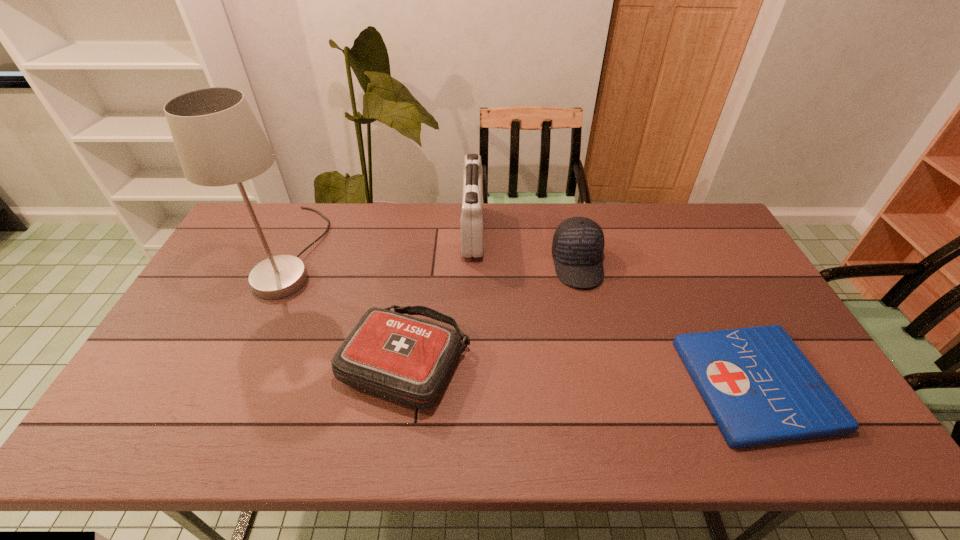
Where is `table lamp`? table lamp is located at coordinates (219, 142).

This screenshot has width=960, height=540. What are the coordinates of `the leftmost object` in the screenshot? It's located at (219, 142).

Locate an element on the screen. the farthest first-aid kit is located at coordinates (472, 218).

This screenshot has height=540, width=960. I want to click on the fourth shortest object, so click(472, 218).

The image size is (960, 540). Find the location of `the fourth object from left to right`. the fourth object from left to right is located at coordinates (578, 243).

In order to click on the third tallest object in this screenshot , I will do pos(578,243).

Locate an element on the screen. This screenshot has width=960, height=540. the fourth tallest object is located at coordinates (408, 360).

Find the location of a particular element. the shortest first-aid kit is located at coordinates (759, 387).

At what (x,y) coordinates should I click in order to perform the action: click on the rightmost first-aid kit. Please return your answer as a coordinate pair (x, y). Looking at the image, I should click on (759, 387).

Find the location of `vacant space located 0.060m on the right of the tallest object`. vacant space located 0.060m on the right of the tallest object is located at coordinates (344, 251).